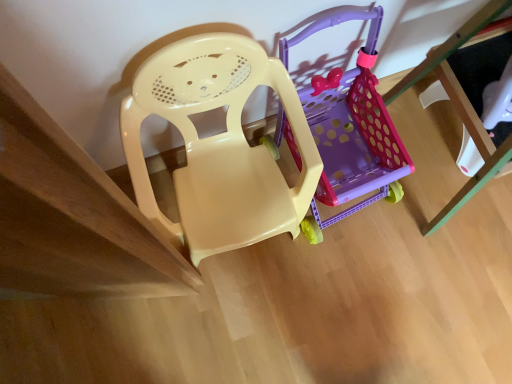
The image size is (512, 384). Find the location of `vacant area that is in front of translucent purple plastic shopping cart at center`. vacant area that is in front of translucent purple plastic shopping cart at center is located at coordinates (336, 288).